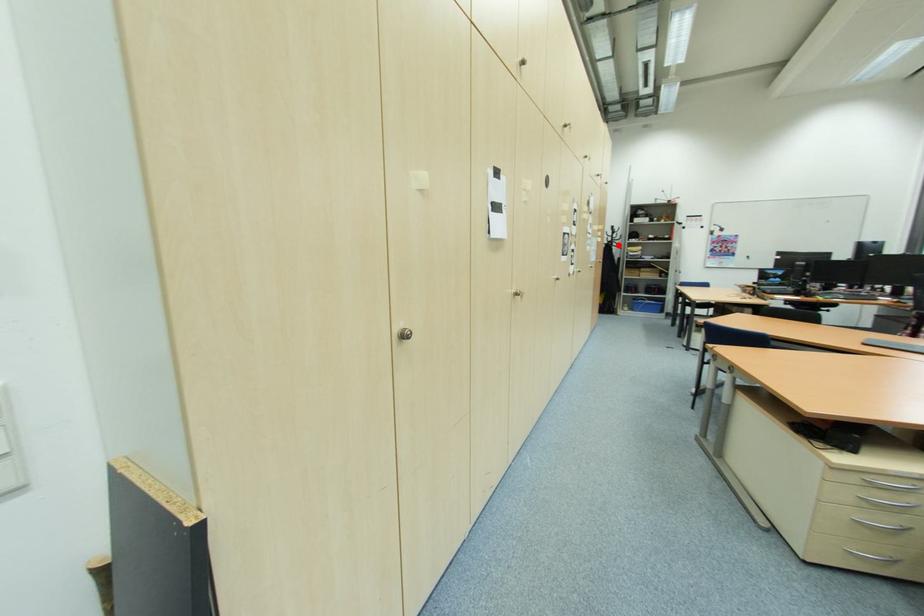
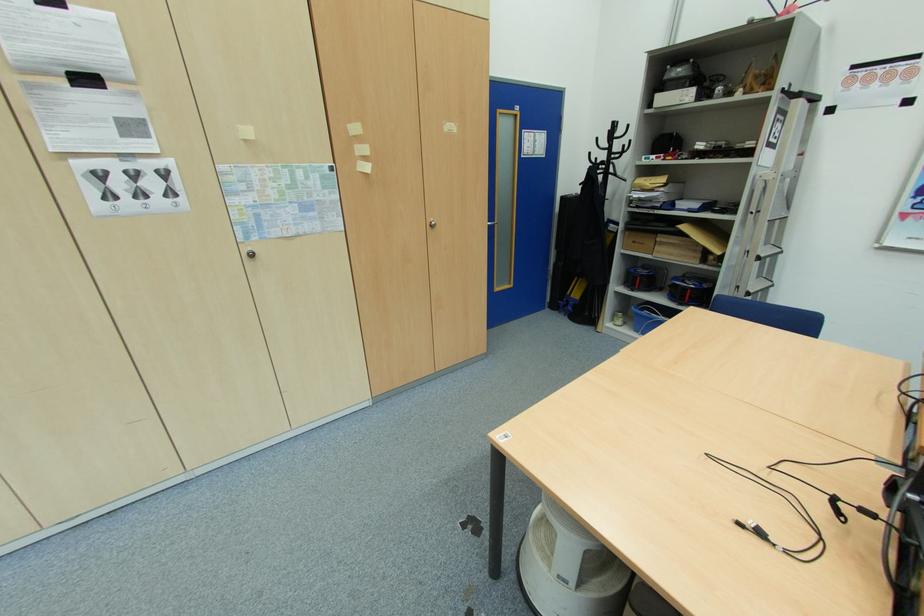
Locate, in the second image, the point that corresponds to the highlighted location in the first image.

(614, 169)